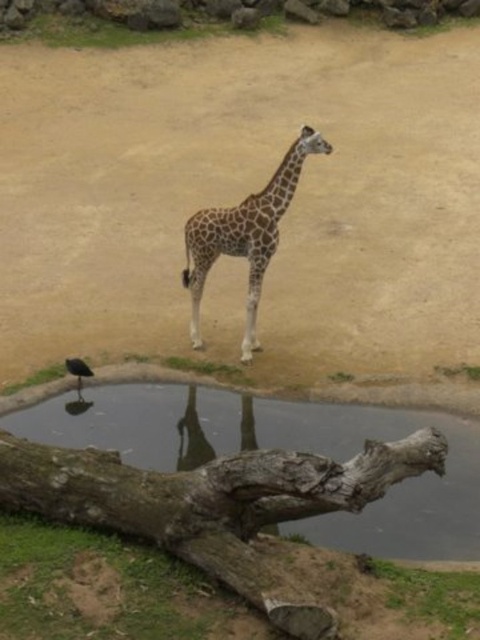
Question: Does brown sandy dirt at center have a smaller size compared to shiny black bird at lower left?

Choices:
 (A) no
 (B) yes

Answer: (A)

Question: Which of these objects is positioned farthest from the brown sandy dirt at center?

Choices:
 (A) spotted fur giraffe at center
 (B) shiny black bird at lower left

Answer: (B)

Question: Which object appears closest to the camera in this image?

Choices:
 (A) shiny black bird at lower left
 (B) gray rough tree trunk at lower center

Answer: (B)

Question: Which object appears closest to the camera in this image?

Choices:
 (A) spotted fur giraffe at center
 (B) brown sandy dirt at center

Answer: (A)

Question: Does brown sandy dirt at center appear over spotted fur giraffe at center?

Choices:
 (A) no
 (B) yes

Answer: (B)

Question: Does gray rough tree trunk at lower center appear under spotted fur giraffe at center?

Choices:
 (A) no
 (B) yes

Answer: (B)